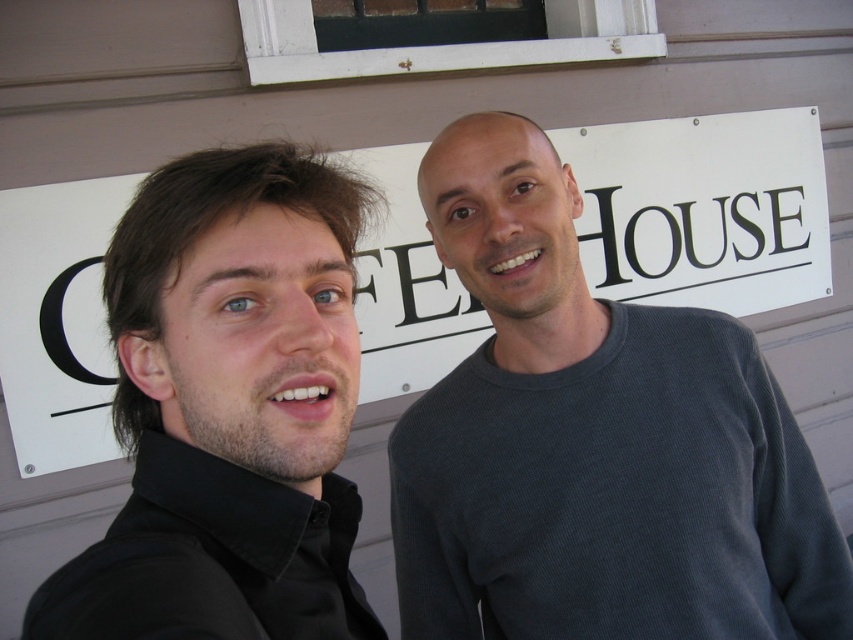
You are standing in front of the building and want to read the white paper sign at center. There is a gray ribbed sweater at center in the way. Can you see the sign clearly?

The gray ribbed sweater at center is closer to the viewer than the white paper sign at center, so it might block your view of the sign.

You are trying to decide which person to approach first at the coffee house. The gray ribbed sweater at center and the black matte shirt at left are both visible. Based on their positions, which one is closer to you?

The gray ribbed sweater at center is closer to you because the black matte shirt at left is behind it.